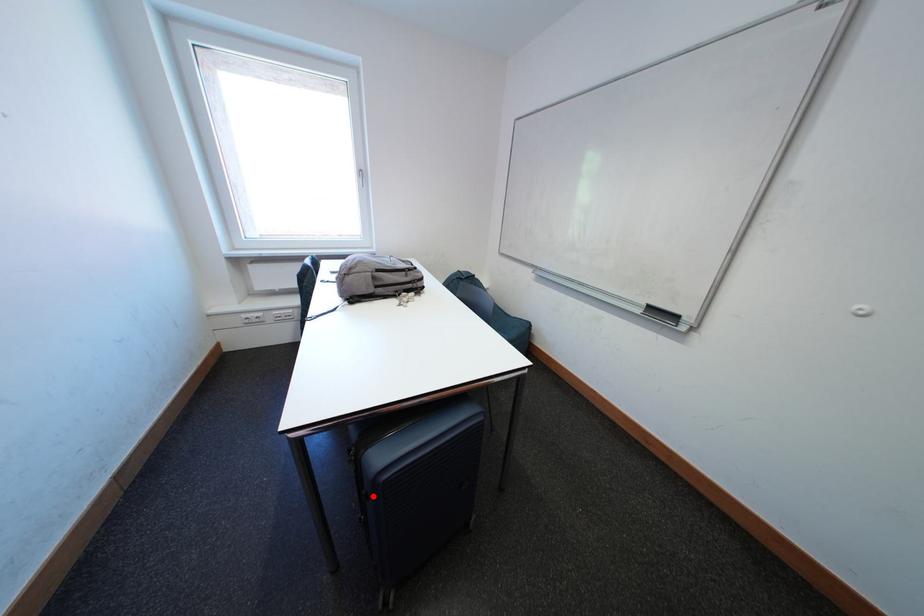
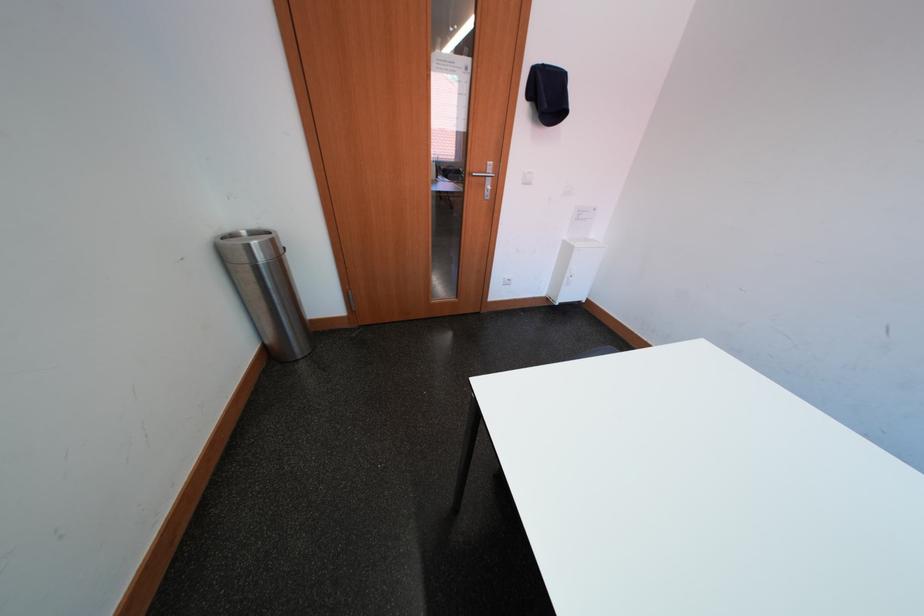
Question: I am providing you with two images of the same scene from different viewpoints. A red point is marked on the first image. Is the red point's position out of view in image 2?

Choices:
 (A) Yes
 (B) No

Answer: (A)